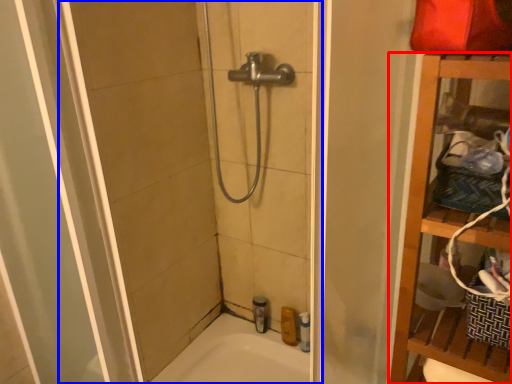
Question: Among these objects, which one is farthest to the camera, furniture (highlighted by a red box) or shower door (highlighted by a blue box)?

Choices:
 (A) furniture
 (B) shower door

Answer: (A)